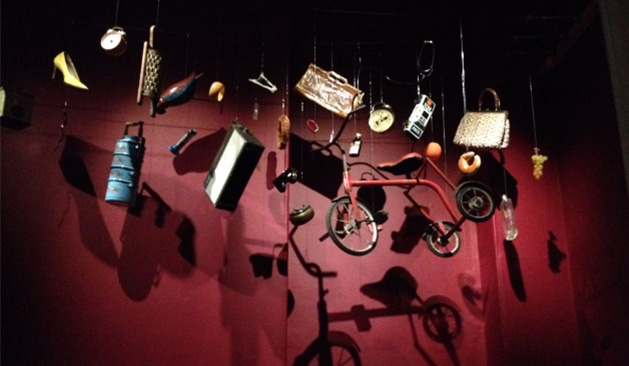
What are the coordinates of `handle` in the screenshot? It's located at (152, 258).